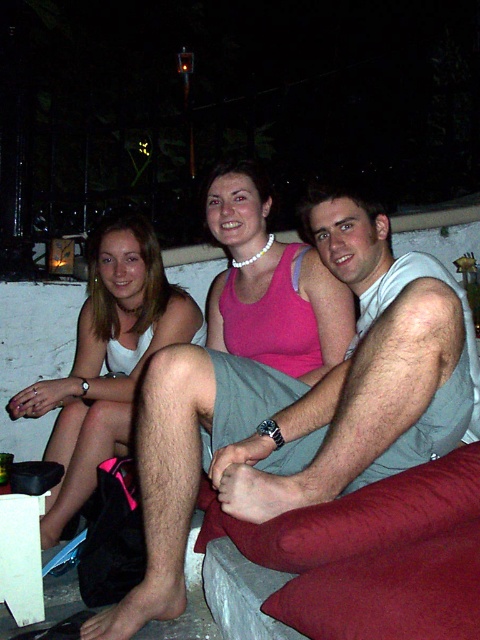
You are a photographer trying to capture the gray fabric shorts at center in the image. Where exactly should you focus your camera lens to ensure the shorts are in the center of the frame?

You should focus your camera lens at point [300,406] to ensure the gray fabric shorts at center are in the center of the frame.

Based on the photo, you are a photographer trying to capture a candid shot of the two people in the image. You notice the gray fabric shorts at center and the white matte tank top at left. Which clothing item is positioned lower in the frame?

The gray fabric shorts at center is below the white matte tank top at left, so the gray fabric shorts at center is positioned lower in the frame.